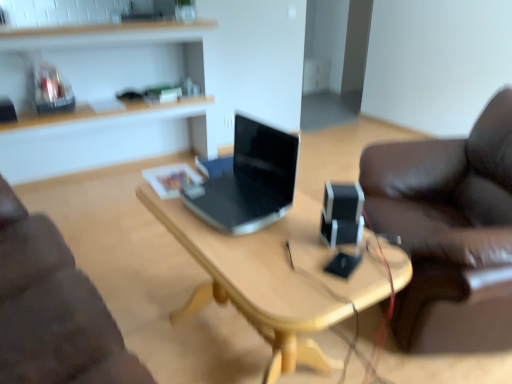
What do you see at coordinates (250, 181) in the screenshot? I see `sleek black laptop at center` at bounding box center [250, 181].

Find the location of a particular element. Image resolution: width=512 pixels, height=384 pixels. wooden at upper left is located at coordinates (103, 35).

What do you see at coordinates (280, 277) in the screenshot? I see `wooden desk at center` at bounding box center [280, 277].

Locate an element on the screen. black plastic speaker at center is located at coordinates (342, 214).

Who is smaller, wooden desk at center or black plastic speaker at center?

With smaller size is black plastic speaker at center.

There is a wooden desk at center. Identify the location of speaker above it (from a real-world perspective). The image size is (512, 384). (342, 214).

Would you say wooden desk at center is to the left or to the right of black plastic speaker at center in the picture?

From the image, it's evident that wooden desk at center is to the left of black plastic speaker at center.

Which object is thinner, wooden desk at center or black plastic speaker at center?

With smaller width is black plastic speaker at center.

Is point (197, 295) positioned before point (94, 40)?

That is True.

Can we say wooden desk at center lies outside wooden at upper left?

Indeed, wooden desk at center is completely outside wooden at upper left.

Who is taller, wooden desk at center or wooden at upper left?

With more height is wooden at upper left.

From the image's perspective, between black plastic speaker at center and wooden desk at center, which one is located above?

black plastic speaker at center appears higher in the image.

Could wooden desk at center be considered to be inside black plastic speaker at center?

No, wooden desk at center is not surrounded by black plastic speaker at center.

Considering the positions of objects black plastic speaker at center and wooden desk at center in the image provided, who is more to the left, black plastic speaker at center or wooden desk at center?

From the viewer's perspective, wooden desk at center appears more on the left side.

From the image's perspective, does sleek black laptop at center appear lower than black plastic speaker at center?

No, from the image's perspective, sleek black laptop at center is not below black plastic speaker at center.

Does sleek black laptop at center touch black plastic speaker at center?

No, sleek black laptop at center is not making contact with black plastic speaker at center.

Is black plastic speaker at center completely or partially inside sleek black laptop at center?

No, black plastic speaker at center is not surrounded by sleek black laptop at center.

Which of these two, sleek black laptop at center or wooden desk at center, stands shorter?

With less height is sleek black laptop at center.

From a real-world perspective, who is located higher, sleek black laptop at center or wooden desk at center?

sleek black laptop at center is physically above.

Is point (266, 216) farther from camera compared to point (266, 282)?

Yes, it is behind point (266, 282).

How different are the orientations of sleek black laptop at center and wooden desk at center in degrees?

0.693 degrees.

What are the coordinates of `shelf located on the left of sleek black laptop at center` in the screenshot? It's located at (103, 35).

Does point (216, 27) come in front of point (230, 201)?

No, (216, 27) is further to viewer.

Does wooden at upper left appear on the left side of sleek black laptop at center?

Yes.

From the image's perspective, is wooden at upper left beneath black plastic speaker at center?

No, from the image's perspective, wooden at upper left is not beneath black plastic speaker at center.

What's the angular difference between wooden at upper left and black plastic speaker at center's facing directions?

The facing directions of wooden at upper left and black plastic speaker at center are 149 degrees apart.

Is wooden at upper left not close to black plastic speaker at center?

Yes, wooden at upper left is far from black plastic speaker at center.

From a real-world perspective, is wooden at upper left located beneath black plastic speaker at center?

Yes, from a real-world perspective, wooden at upper left is beneath black plastic speaker at center.

You are a GUI agent. You are given a task and a screenshot of the screen. Output one action in this format:
    pyautogui.click(x=<x>, y=<y>)
    Task: Click on the speaker behind the wooden desk at center
    
    Given the screenshot: What is the action you would take?
    pyautogui.click(x=342, y=214)

Locate an element on the screen. desk below the wooden at upper left (from a real-world perspective) is located at coordinates (280, 277).

Considering their positions, is black plastic speaker at center positioned further to sleek black laptop at center than wooden desk at center?

black plastic speaker at center.

Looking at the image, which one is located closer to sleek black laptop at center, wooden at upper left or black plastic speaker at center?

black plastic speaker at center.

When comparing their distances from black plastic speaker at center, does sleek black laptop at center or wooden desk at center seem closer?

Among the two, wooden desk at center is located nearer to black plastic speaker at center.

Considering their positions, is sleek black laptop at center positioned closer to black plastic speaker at center than wooden at upper left?

sleek black laptop at center lies closer to black plastic speaker at center than the other object.

Considering their positions, is wooden at upper left positioned further to wooden desk at center than sleek black laptop at center?

Based on the image, wooden at upper left appears to be further to wooden desk at center.

Estimate the real-world distances between objects in this image. Which object is further from wooden at upper left, black plastic speaker at center or sleek black laptop at center?

black plastic speaker at center lies further to wooden at upper left than the other object.

When comparing their distances from black plastic speaker at center, does wooden desk at center or sleek black laptop at center seem closer?

Based on the image, wooden desk at center appears to be nearer to black plastic speaker at center.

Estimate the real-world distances between objects in this image. Which object is further from wooden at upper left, sleek black laptop at center or black plastic speaker at center?

black plastic speaker at center is positioned further to the anchor wooden at upper left.

I want to click on speaker between wooden desk at center and wooden at upper left along the z-axis, so (342, 214).

In order to click on speaker between sleek black laptop at center and wooden desk at center in the up-down direction in this screenshot , I will do `click(342, 214)`.

At what (x,y) coordinates should I click in order to perform the action: click on laptop located between wooden desk at center and wooden at upper left in the depth direction. Please return your answer as a coordinate pair (x, y). Looking at the image, I should click on (250, 181).

Where is `laptop between wooden at upper left and black plastic speaker at center`? The image size is (512, 384). laptop between wooden at upper left and black plastic speaker at center is located at coordinates (250, 181).